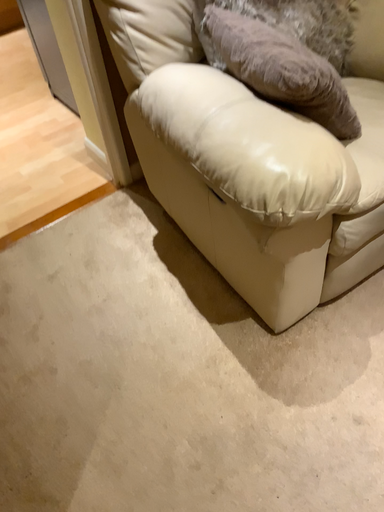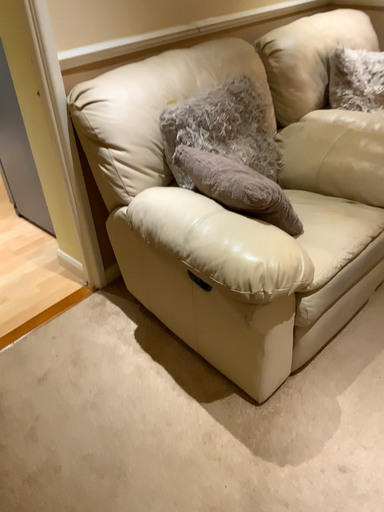
Question: How did the camera likely rotate when shooting the video?

Choices:
 (A) rotated downward
 (B) rotated upward

Answer: (B)